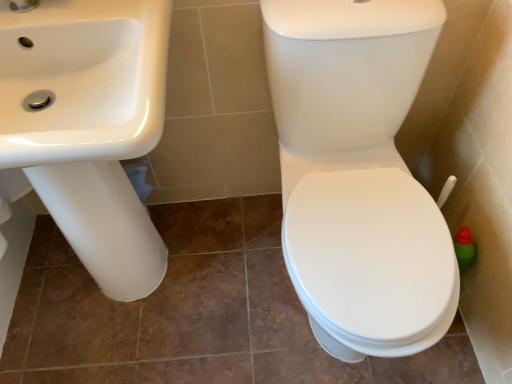
Where is `white glossy sink at left`? This screenshot has width=512, height=384. white glossy sink at left is located at coordinates (89, 126).

Describe the element at coordinates (89, 126) in the screenshot. I see `white glossy sink at left` at that location.

Measure the distance between point [341,252] and camera.

35.08 inches.

The width and height of the screenshot is (512, 384). I want to click on white glossy toilet at right, so click(358, 174).

What do you see at coordinates (358, 174) in the screenshot? The width and height of the screenshot is (512, 384). I see `white glossy toilet at right` at bounding box center [358, 174].

The width and height of the screenshot is (512, 384). In order to click on white glossy sink at left in this screenshot , I will do `click(89, 126)`.

Which object is positioned more to the right, white glossy sink at left or white glossy toilet at right?

From the viewer's perspective, white glossy toilet at right appears more on the right side.

Is white glossy sink at left in front of or behind white glossy toilet at right in the image?

Clearly, white glossy sink at left is behind white glossy toilet at right.

Is point (114, 277) more distant than point (373, 211)?

Yes, point (114, 277) is behind point (373, 211).

From the image's perspective, between white glossy sink at left and white glossy toilet at right, who is located below?

white glossy toilet at right.

From a real-world perspective, which object rests below the other?

white glossy toilet at right, from a real-world perspective.

Considering the relative sizes of white glossy sink at left and white glossy toilet at right in the image provided, is white glossy sink at left wider than white glossy toilet at right?

No, white glossy sink at left is not wider than white glossy toilet at right.

Between white glossy sink at left and white glossy toilet at right, which one has less height?

With less height is white glossy toilet at right.

Who is smaller, white glossy sink at left or white glossy toilet at right?

With smaller size is white glossy sink at left.

Is white glossy sink at left situated inside white glossy toilet at right or outside?

white glossy sink at left exists outside the volume of white glossy toilet at right.

Is white glossy sink at left positioned far away from white glossy toilet at right?

No, white glossy sink at left is in close proximity to white glossy toilet at right.

Does white glossy sink at left turn towards white glossy toilet at right?

No, white glossy sink at left does not turn towards white glossy toilet at right.

How many degrees apart are the facing directions of white glossy sink at left and white glossy toilet at right?

white glossy sink at left and white glossy toilet at right are facing 1.53 degrees away from each other.

How much distance is there between white glossy sink at left and white glossy toilet at right?

white glossy sink at left is 17.65 inches from white glossy toilet at right.

In the image, there is a white glossy toilet at right. Identify the location of sink above it (from the image's perspective). click(x=89, y=126).

Which object is positioned more to the left, white glossy toilet at right or white glossy sink at left?

Positioned to the left is white glossy sink at left.

Relative to white glossy sink at left, is white glossy toilet at right in front or behind?

Visually, white glossy toilet at right is located in front of white glossy sink at left.

Is point (313, 48) closer to viewer compared to point (123, 274)?

That is True.

In the scene shown: From the image's perspective, which object appears higher, white glossy toilet at right or white glossy sink at left?

From the image's view, white glossy sink at left is above.

Consider the image. From a real-world perspective, who is located higher, white glossy toilet at right or white glossy sink at left?

From a 3D spatial view, white glossy sink at left is above.

Considering the sizes of objects white glossy toilet at right and white glossy sink at left in the image provided, who is thinner, white glossy toilet at right or white glossy sink at left?

Thinner between the two is white glossy sink at left.

Is white glossy toilet at right taller than white glossy sink at left?

Incorrect, the height of white glossy toilet at right is not larger of that of white glossy sink at left.

In the scene shown: Which of these two, white glossy toilet at right or white glossy sink at left, is smaller?

With smaller size is white glossy sink at left.

Is white glossy toilet at right not within white glossy sink at left?

white glossy toilet at right lies outside white glossy sink at left's area.

Is white glossy toilet at right directly adjacent to white glossy sink at left?

No, white glossy toilet at right is not touching white glossy sink at left.

Is white glossy toilet at right facing away from white glossy sink at left?

No.

The height and width of the screenshot is (384, 512). I want to click on toilet to the right of white glossy sink at left, so pos(358,174).

You are a GUI agent. You are given a task and a screenshot of the screen. Output one action in this format:
    pyautogui.click(x=<x>, y=<y>)
    Task: Click on the toilet lying below the white glossy sink at left (from the image's perspective)
    This screenshot has width=512, height=384.
    Given the screenshot: What is the action you would take?
    pyautogui.click(x=358, y=174)

You are a GUI agent. You are given a task and a screenshot of the screen. Output one action in this format:
    pyautogui.click(x=<x>, y=<y>)
    Task: Click on the sink above the white glossy toilet at right (from the image's perspective)
    
    Given the screenshot: What is the action you would take?
    pyautogui.click(x=89, y=126)